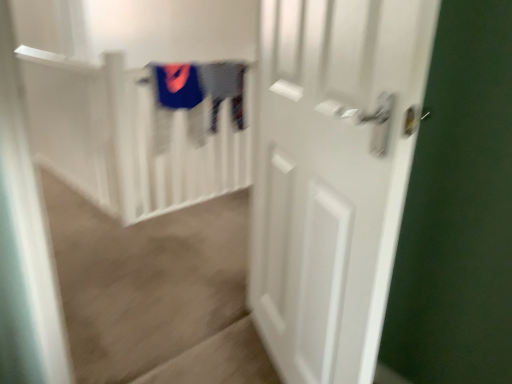
Question: Visually, is white matte door at right positioned to the left or to the right of white matte stair railing at upper center?

Choices:
 (A) right
 (B) left

Answer: (A)

Question: Choose the correct answer: Is white matte door at right inside white matte stair railing at upper center or outside it?

Choices:
 (A) inside
 (B) outside

Answer: (B)

Question: Estimate the real-world distances between objects in this image. Which object is closer to the velvet blue sweater at upper center, which is counted as the first clothing, starting from the left?

Choices:
 (A) white matte door at right
 (B) white matte stair railing at upper center
 (C) gray cotton sweater at upper center, which is the first clothing from right to left

Answer: (C)

Question: Which object is the farthest from the gray cotton sweater at upper center, the second clothing from the left?

Choices:
 (A) velvet blue sweater at upper center, positioned as the 2th clothing in right-to-left order
 (B) white matte door at right
 (C) white matte stair railing at upper center

Answer: (B)